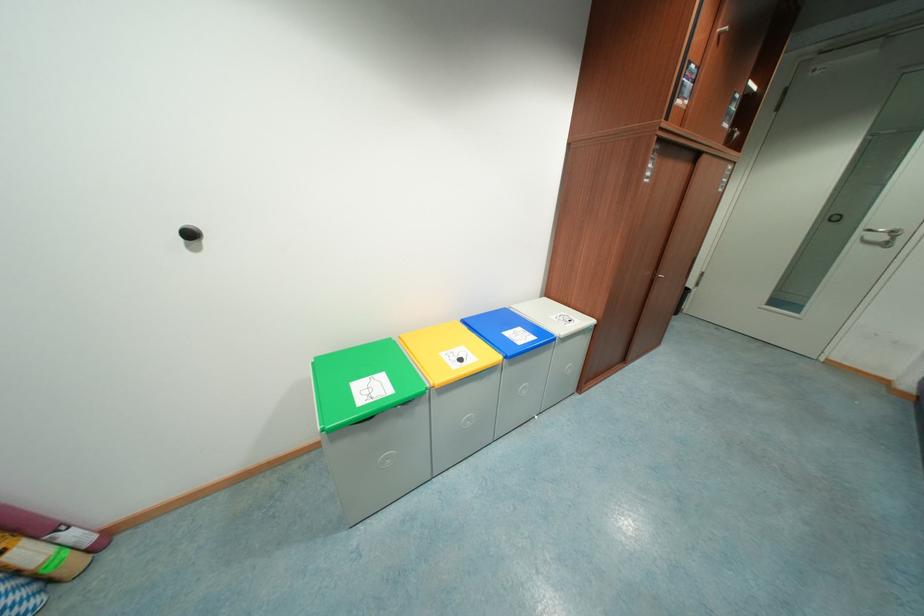
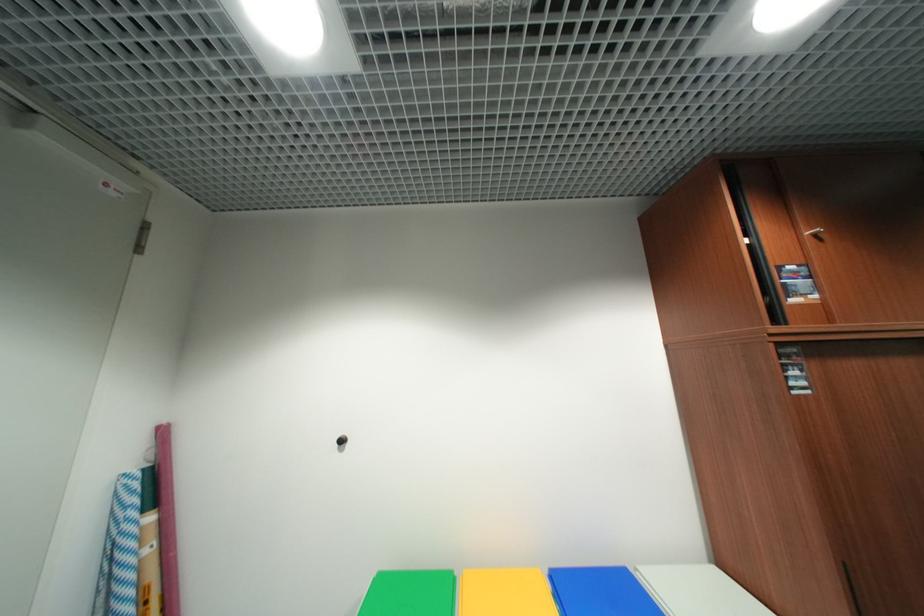
First-person continuous shooting, in which direction is the camera rotating?

The camera's rotation is toward left-up.